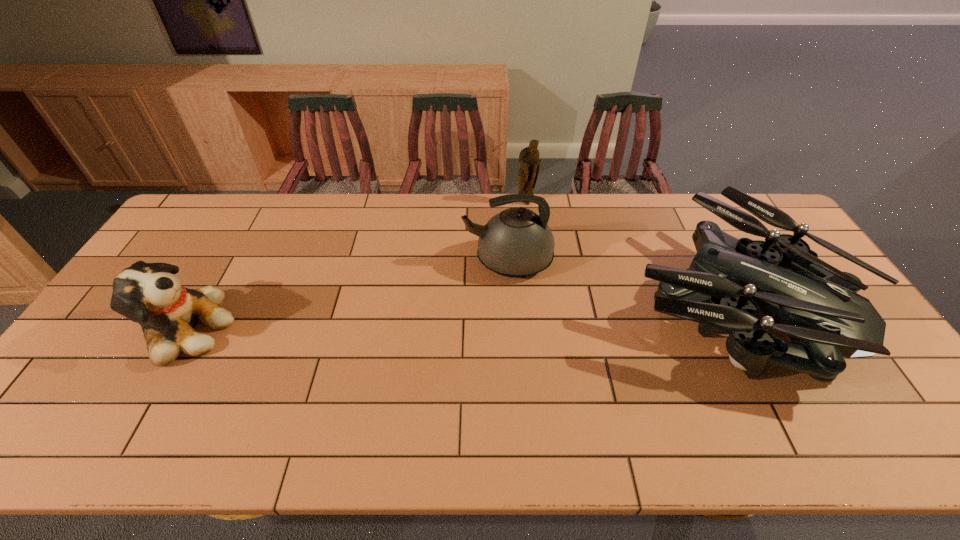
Locate an element on the screen. This screenshot has width=960, height=540. figurine is located at coordinates (529, 162).

I want to click on kettle, so click(516, 243).

Where is `the leftmost object`? the leftmost object is located at coordinates click(149, 294).

This screenshot has height=540, width=960. In order to click on the rightmost object in this screenshot , I will do `click(730, 281)`.

Identify the location of vacant region located on the front-facing side of the farthest object. (529, 233).

You are a GUI agent. You are given a task and a screenshot of the screen. Output one action in this format:
    pyautogui.click(x=<x>, y=<y>)
    Task: Click on the vacant region located at the spout of the kettle
    This screenshot has height=540, width=960.
    Given the screenshot: What is the action you would take?
    pyautogui.click(x=373, y=261)

Locate an element on the screen. The height and width of the screenshot is (540, 960). vacant region located at the spout of the kettle is located at coordinates (408, 261).

Locate an element on the screen. This screenshot has width=960, height=540. free space located at the spout of the kettle is located at coordinates (370, 261).

Identify the location of blank space located at the face of the leftmost object. This screenshot has width=960, height=540. (252, 329).

I want to click on free location located 0.070m on the back of the drone, so click(x=687, y=220).